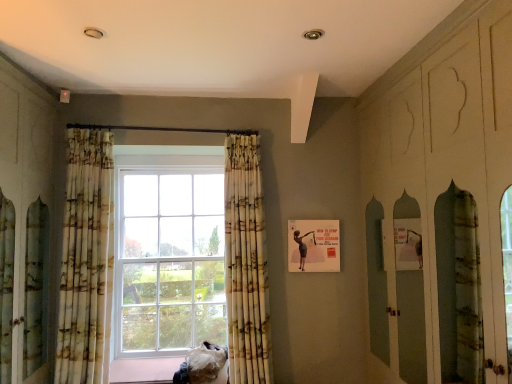
Where is `fuzzy fabric cat at lower center`? fuzzy fabric cat at lower center is located at coordinates (204, 366).

The image size is (512, 384). What are the coordinates of `fuzzy fabric cat at lower center` in the screenshot? It's located at (204, 366).

Between point (239, 185) and point (102, 346), which one is positioned in front?

Positioned in front is point (102, 346).

Could you tell me if printed fabric curtain at center, marked as the 2th curtain in a left-to-right arrangement, is turned towards printed fabric curtain at left, which is the first curtain in left-to-right order?

No, printed fabric curtain at center, marked as the 2th curtain in a left-to-right arrangement, is not facing towards printed fabric curtain at left, which is the first curtain in left-to-right order.

Considering the relative positions of printed fabric curtain at center, which is the first curtain in right-to-left order, and printed fabric curtain at left, which is the first curtain in left-to-right order, in the image provided, is printed fabric curtain at center, which is the first curtain in right-to-left order, to the right of printed fabric curtain at left, which is the first curtain in left-to-right order, from the viewer's perspective?

Correct, you'll find printed fabric curtain at center, which is the first curtain in right-to-left order, to the right of printed fabric curtain at left, which is the first curtain in left-to-right order.

Find the location of a particular element. The width and height of the screenshot is (512, 384). curtain located on the right of printed fabric curtain at left, which is the first curtain in left-to-right order is located at coordinates (246, 264).

Is printed fabric curtain at left, the 2th curtain in the right-to-left sequence, a part of fuzzy fabric cat at lower center?

No, printed fabric curtain at left, the 2th curtain in the right-to-left sequence, is located outside of fuzzy fabric cat at lower center.

From the picture: From the image's perspective, would you say fuzzy fabric cat at lower center is positioned over printed fabric curtain at left, the 2th curtain in the right-to-left sequence?

No, from the image's perspective, fuzzy fabric cat at lower center is not over printed fabric curtain at left, the 2th curtain in the right-to-left sequence.

Is fuzzy fabric cat at lower center turned away from printed fabric curtain at left, which is the first curtain in left-to-right order?

No, fuzzy fabric cat at lower center is not facing the opposite direction of printed fabric curtain at left, which is the first curtain in left-to-right order.

Considering the sizes of objects fuzzy fabric cat at lower center and printed fabric curtain at left, which is the first curtain in left-to-right order, in the image provided, who is shorter, fuzzy fabric cat at lower center or printed fabric curtain at left, which is the first curtain in left-to-right order,?

fuzzy fabric cat at lower center.

Is printed fabric curtain at center, which is the first curtain in right-to-left order, shorter than fuzzy fabric cat at lower center?

No, printed fabric curtain at center, which is the first curtain in right-to-left order, is not shorter than fuzzy fabric cat at lower center.

Is printed fabric curtain at center, which is the first curtain in right-to-left order, placed right next to fuzzy fabric cat at lower center?

There is a gap between printed fabric curtain at center, which is the first curtain in right-to-left order, and fuzzy fabric cat at lower center.

Considering the relative sizes of printed fabric curtain at center, which is the first curtain in right-to-left order, and fuzzy fabric cat at lower center in the image provided, is printed fabric curtain at center, which is the first curtain in right-to-left order, thinner than fuzzy fabric cat at lower center?

Correct, the width of printed fabric curtain at center, which is the first curtain in right-to-left order, is less than that of fuzzy fabric cat at lower center.

How different are the orientations of printed fabric curtain at left, the 2th curtain in the right-to-left sequence, and fuzzy fabric cat at lower center in degrees?

The facing directions of printed fabric curtain at left, the 2th curtain in the right-to-left sequence, and fuzzy fabric cat at lower center are 3.32 degrees apart.

Does printed fabric curtain at left, which is the first curtain in left-to-right order, turn towards fuzzy fabric cat at lower center?

No.

Between printed fabric curtain at left, the 2th curtain in the right-to-left sequence, and fuzzy fabric cat at lower center, which one has less height?

fuzzy fabric cat at lower center.

Relative to fuzzy fabric cat at lower center, is printed fabric curtain at left, which is the first curtain in left-to-right order, in front or behind?

Clearly, printed fabric curtain at left, which is the first curtain in left-to-right order, is in front of fuzzy fabric cat at lower center.

Is fuzzy fabric cat at lower center bigger or smaller than printed fabric curtain at center, marked as the 2th curtain in a left-to-right arrangement?

fuzzy fabric cat at lower center is smaller than printed fabric curtain at center, marked as the 2th curtain in a left-to-right arrangement.

Between fuzzy fabric cat at lower center and printed fabric curtain at center, which is the first curtain in right-to-left order, which one appears on the right side from the viewer's perspective?

Positioned to the right is printed fabric curtain at center, which is the first curtain in right-to-left order.

Between point (192, 359) and point (264, 377), which one is positioned behind?

The point (192, 359) is farther from the camera.

Who is more distant, fuzzy fabric cat at lower center or printed fabric curtain at center, marked as the 2th curtain in a left-to-right arrangement?

fuzzy fabric cat at lower center.

From the image's perspective, is printed fabric curtain at left, the 2th curtain in the right-to-left sequence, positioned above or below printed fabric curtain at center, marked as the 2th curtain in a left-to-right arrangement?

Clearly, from the image's perspective, printed fabric curtain at left, the 2th curtain in the right-to-left sequence, is above printed fabric curtain at center, marked as the 2th curtain in a left-to-right arrangement.

Visually, is printed fabric curtain at left, which is the first curtain in left-to-right order, positioned to the left or to the right of printed fabric curtain at center, marked as the 2th curtain in a left-to-right arrangement?

From the image, it's evident that printed fabric curtain at left, which is the first curtain in left-to-right order, is to the left of printed fabric curtain at center, marked as the 2th curtain in a left-to-right arrangement.

Which of these two, printed fabric curtain at left, the 2th curtain in the right-to-left sequence, or printed fabric curtain at center, which is the first curtain in right-to-left order, stands shorter?

printed fabric curtain at left, the 2th curtain in the right-to-left sequence, is shorter.

Are printed fabric curtain at left, the 2th curtain in the right-to-left sequence, and printed fabric curtain at center, marked as the 2th curtain in a left-to-right arrangement, far apart?

Indeed, printed fabric curtain at left, the 2th curtain in the right-to-left sequence, is not near printed fabric curtain at center, marked as the 2th curtain in a left-to-right arrangement.

This screenshot has width=512, height=384. I want to click on curtain on the right of the printed fabric curtain at left, which is the first curtain in left-to-right order, so click(246, 264).

Locate an element on the screen. furniture that appears below the printed fabric curtain at left, which is the first curtain in left-to-right order (from the image's perspective) is located at coordinates (204, 366).

Which object lies nearer to the anchor point printed fabric curtain at left, which is the first curtain in left-to-right order, fuzzy fabric cat at lower center or printed fabric curtain at center, marked as the 2th curtain in a left-to-right arrangement?

fuzzy fabric cat at lower center is positioned closer to the anchor printed fabric curtain at left, which is the first curtain in left-to-right order.

Looking at the image, which one is located closer to printed fabric curtain at center, marked as the 2th curtain in a left-to-right arrangement, printed fabric curtain at left, which is the first curtain in left-to-right order, or fuzzy fabric cat at lower center?

fuzzy fabric cat at lower center is closer to printed fabric curtain at center, marked as the 2th curtain in a left-to-right arrangement.

Considering their positions, is printed fabric curtain at center, marked as the 2th curtain in a left-to-right arrangement, positioned closer to printed fabric curtain at left, which is the first curtain in left-to-right order, than fuzzy fabric cat at lower center?

fuzzy fabric cat at lower center lies closer to printed fabric curtain at left, which is the first curtain in left-to-right order, than the other object.

Which object lies further to the anchor point printed fabric curtain at center, marked as the 2th curtain in a left-to-right arrangement, fuzzy fabric cat at lower center or printed fabric curtain at left, which is the first curtain in left-to-right order?

Based on the image, printed fabric curtain at left, which is the first curtain in left-to-right order, appears to be further to printed fabric curtain at center, marked as the 2th curtain in a left-to-right arrangement.

Looking at the image, which one is located further to fuzzy fabric cat at lower center, printed fabric curtain at left, which is the first curtain in left-to-right order, or printed fabric curtain at center, marked as the 2th curtain in a left-to-right arrangement?

The object further to fuzzy fabric cat at lower center is printed fabric curtain at left, which is the first curtain in left-to-right order.

When comparing their distances from fuzzy fabric cat at lower center, does printed fabric curtain at center, marked as the 2th curtain in a left-to-right arrangement, or printed fabric curtain at left, the 2th curtain in the right-to-left sequence, seem further?

Among the two, printed fabric curtain at left, the 2th curtain in the right-to-left sequence, is located further to fuzzy fabric cat at lower center.

The image size is (512, 384). Identify the location of furniture located between printed fabric curtain at left, which is the first curtain in left-to-right order, and printed fabric curtain at center, which is the first curtain in right-to-left order, in the left-right direction. (204, 366).